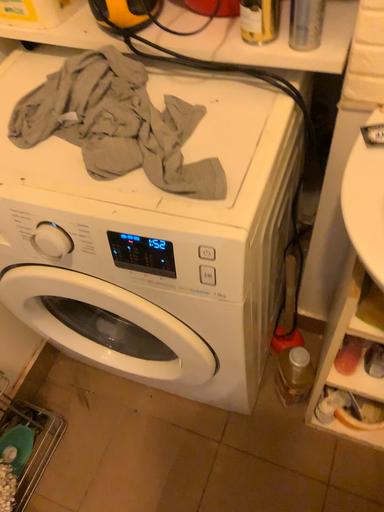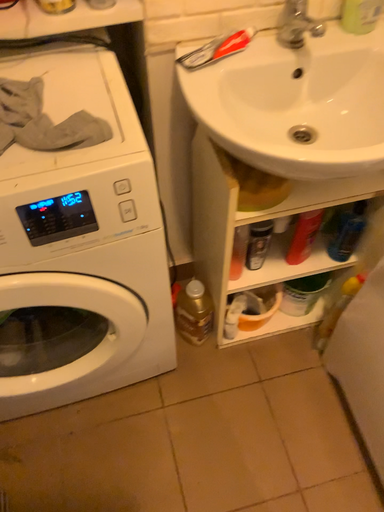
Question: How did the camera likely rotate when shooting the video?

Choices:
 (A) rotated right
 (B) rotated left

Answer: (A)